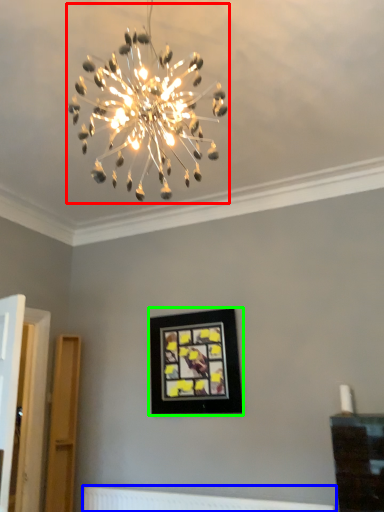
Question: Which is nearer to the lamp (highlighted by a red box)? radiator (highlighted by a blue box) or picture frame (highlighted by a green box).

Choices:
 (A) radiator
 (B) picture frame

Answer: (B)